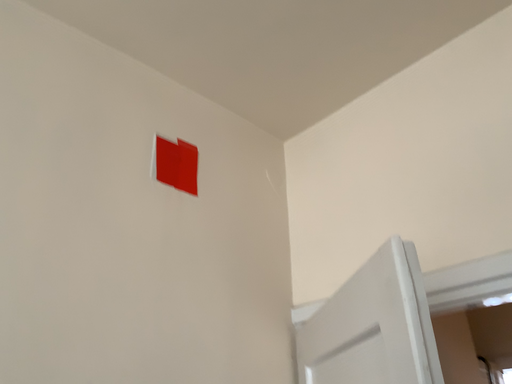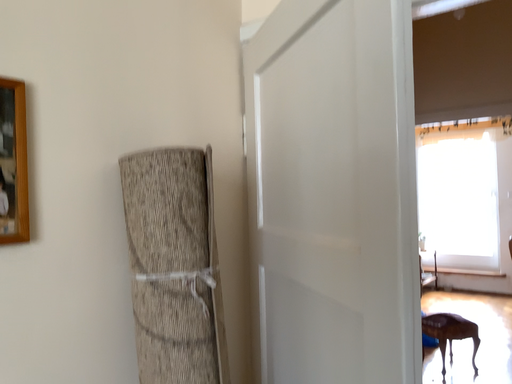
Question: Which way did the camera rotate in the video?

Choices:
 (A) rotated downward
 (B) rotated upward

Answer: (A)